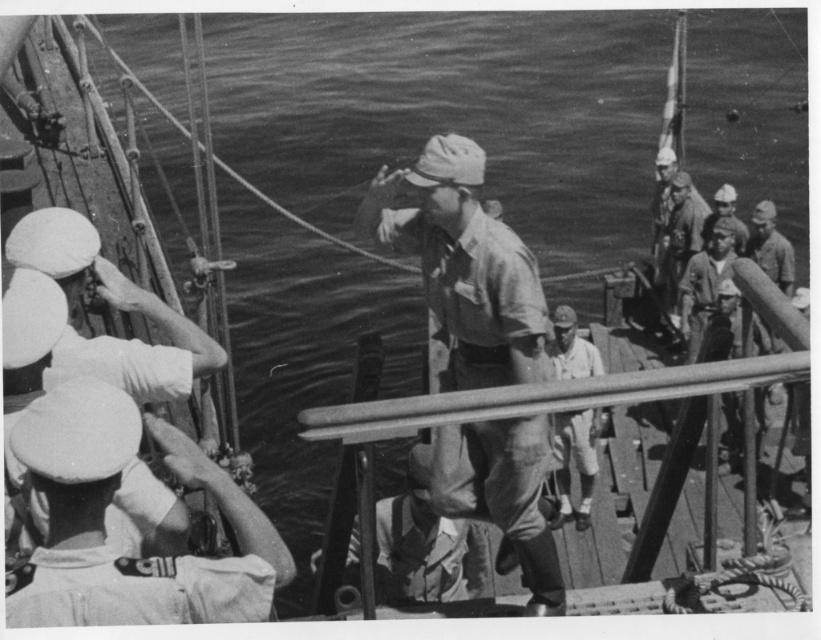
Can you confirm if white matte uniform at left is positioned below light beige uniform at center?

No, white matte uniform at left is not below light beige uniform at center.

Where is `white matte uniform at left`? The width and height of the screenshot is (821, 640). white matte uniform at left is located at coordinates (x=104, y=531).

This screenshot has height=640, width=821. What are the coordinates of `white matte uniform at left` in the screenshot? It's located at (104, 531).

This screenshot has width=821, height=640. What are the coordinates of `white matte uniform at left` in the screenshot? It's located at (104, 531).

Is matte khaki uniform at center positioned at the back of smooth skin face at upper right?

That is False.

Between point (447, 369) and point (723, 189), which one is positioned behind?

The point (723, 189) is more distant.

Who is more distant from viewer, (489, 497) or (745, 228)?

Positioned behind is point (745, 228).

Find the location of `matte khaki uniform at center`. matte khaki uniform at center is located at coordinates (464, 266).

Which is in front, point (420, 228) or point (205, 595)?

Point (205, 595) is more forward.

Does matte khaki uniform at center come in front of white matte uniform at left?

No, it is behind white matte uniform at left.

Locate an element on the screen. The height and width of the screenshot is (640, 821). matte khaki uniform at center is located at coordinates (464, 266).